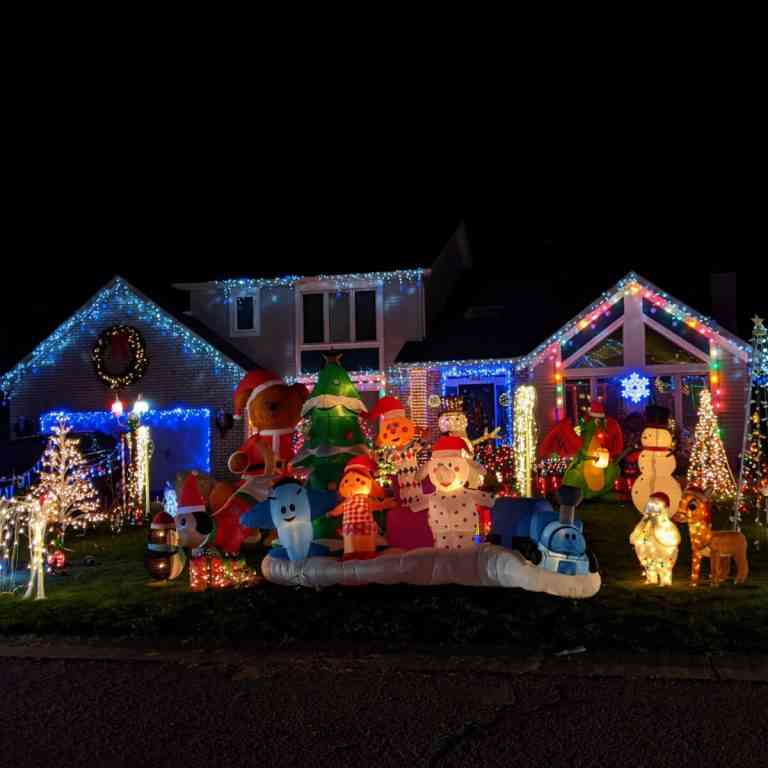
Where is `inflatable decor`? The image size is (768, 768). inflatable decor is located at coordinates (326, 521).